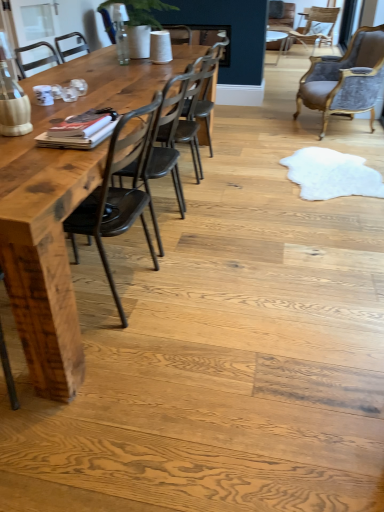
Question: Can you confirm if dark brown wood chair at center, the 4th chair from the right, is smaller than velvet grey chair at upper right, placed as the second chair when sorted from right to left?

Choices:
 (A) no
 (B) yes

Answer: (B)

Question: From the image's perspective, does dark brown wood chair at center, placed as the first chair when sorted from bottom to top, appear higher than velvet grey chair at upper right, the third chair when ordered from front to back?

Choices:
 (A) no
 (B) yes

Answer: (A)

Question: Is dark brown wood chair at center, the first chair when ordered from front to back, turned away from velvet grey chair at upper right, which ranks as the 3th chair in left-to-right order?

Choices:
 (A) yes
 (B) no

Answer: (B)

Question: Is the position of dark brown wood chair at center, acting as the 1th chair starting from the left, more distant than that of velvet grey chair at upper right, arranged as the third chair when ordered from the bottom?

Choices:
 (A) no
 (B) yes

Answer: (A)

Question: Could you tell me if dark brown wood chair at center, placed as the first chair when sorted from bottom to top, is facing velvet grey chair at upper right, arranged as the third chair when ordered from the bottom?

Choices:
 (A) yes
 (B) no

Answer: (B)

Question: Is dark brown wood chair at center, acting as the 1th chair starting from the left, at the left side of velvet grey chair at upper right, placed as the second chair when sorted from right to left?

Choices:
 (A) no
 (B) yes

Answer: (B)

Question: Is wooden table at left at the right side of dark brown wood chair at center, the 4th chair from the right?

Choices:
 (A) yes
 (B) no

Answer: (B)

Question: From a real-world perspective, is wooden table at left on dark brown wood chair at center, acting as the 1th chair starting from the left?

Choices:
 (A) no
 (B) yes

Answer: (A)

Question: Is wooden table at left next to dark brown wood chair at center, the 4th chair from the back?

Choices:
 (A) no
 (B) yes

Answer: (A)

Question: Is wooden table at left positioned behind dark brown wood chair at center, the 4th chair from the back?

Choices:
 (A) yes
 (B) no

Answer: (B)

Question: Is wooden table at left smaller than dark brown wood chair at center, placed as the first chair when sorted from bottom to top?

Choices:
 (A) no
 (B) yes

Answer: (A)

Question: Considering the relative sizes of wooden table at left and dark brown wood chair at center, placed as the first chair when sorted from bottom to top, in the image provided, is wooden table at left shorter than dark brown wood chair at center, placed as the first chair when sorted from bottom to top,?

Choices:
 (A) no
 (B) yes

Answer: (B)

Question: Would you consider velvet upholstered chair at upper right, which is counted as the 1th chair, starting from the back, to be distant from dark brown wood chair at center, which is the fourth chair from top to bottom?

Choices:
 (A) yes
 (B) no

Answer: (A)